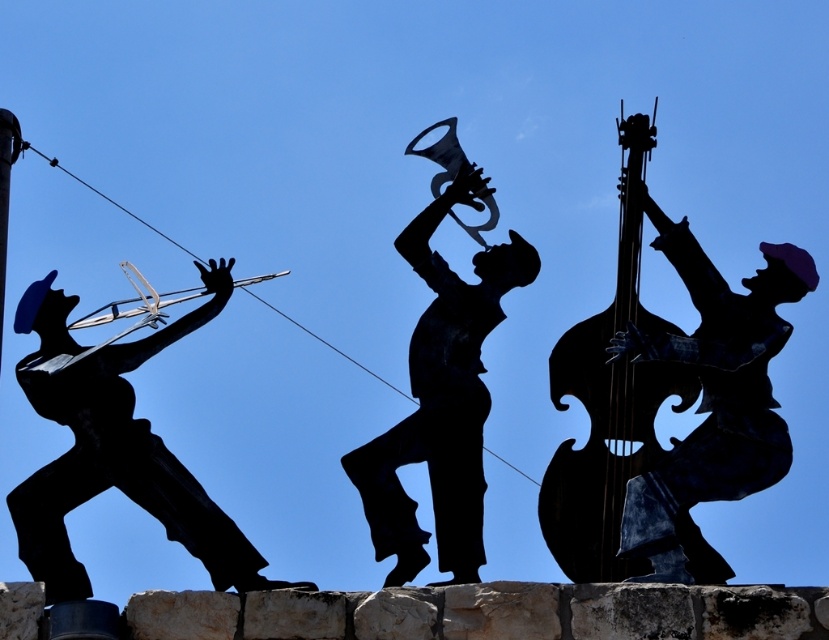
Measure the distance between point (422, 326) and camera.

Point (422, 326) is 478.18 feet from camera.

Is the position of black metal trumpet at center less distant than that of metallic dark brown cello at right?

No.

The width and height of the screenshot is (829, 640). What do you see at coordinates (440, 400) in the screenshot? I see `black metal trumpet at center` at bounding box center [440, 400].

Where is `black metal trumpet at center`? The width and height of the screenshot is (829, 640). black metal trumpet at center is located at coordinates (440, 400).

Which is below, black matte bass at right or metallic dark brown cello at right?

Positioned lower is black matte bass at right.

Does black matte bass at right appear on the left side of metallic dark brown cello at right?

No, black matte bass at right is not to the left of metallic dark brown cello at right.

Which is in front, point (711, 582) or point (648, 422)?

Positioned in front is point (711, 582).

Image resolution: width=829 pixels, height=640 pixels. Find the location of `black matte bass at right`. black matte bass at right is located at coordinates (711, 403).

Is black matte bass at right to the left of black metal trumpet at center from the viewer's perspective?

No, black matte bass at right is not to the left of black metal trumpet at center.

Can you confirm if black matte bass at right is bigger than black metal trumpet at center?

Yes.

Is point (762, 428) positioned after point (487, 278)?

No, it is in front of (487, 278).

Locate an element on the screen. The image size is (829, 640). black matte bass at right is located at coordinates (711, 403).